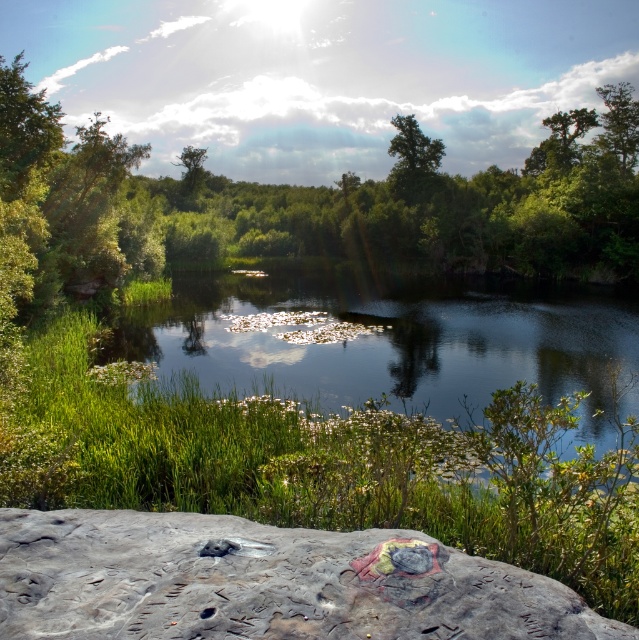
You are standing at the edge of the water and want to place a small statue on the rough stone boulder at lower center. Considering the statue is 1 meter tall, will it be taller than the green leafy tree at upper center?

The rough stone boulder at lower center has a lesser height compared to the green leafy tree at upper center. Since the statue is only 1 meter tall, it is unclear if it will be taller than the tree without knowing the tree height. However, the boulder itself is shorter than the tree, so the statue might not surpass the tree in height.

You are planning to install a small solar panel that requires a direct line of sight to the sun without obstruction. You have two options for placement based on the scene described. The first option is to place it on the rough stone boulder at lower center, and the second is to place it under the green leafy tree at upper center. Which location would provide better sunlight access, and why?

The rough stone boulder at lower center would provide better sunlight access because it is farther away from the green leafy tree at upper center, which is 122.20 meters apart. The distance reduces the likelihood of the tree casting a shadow over the solar panel.